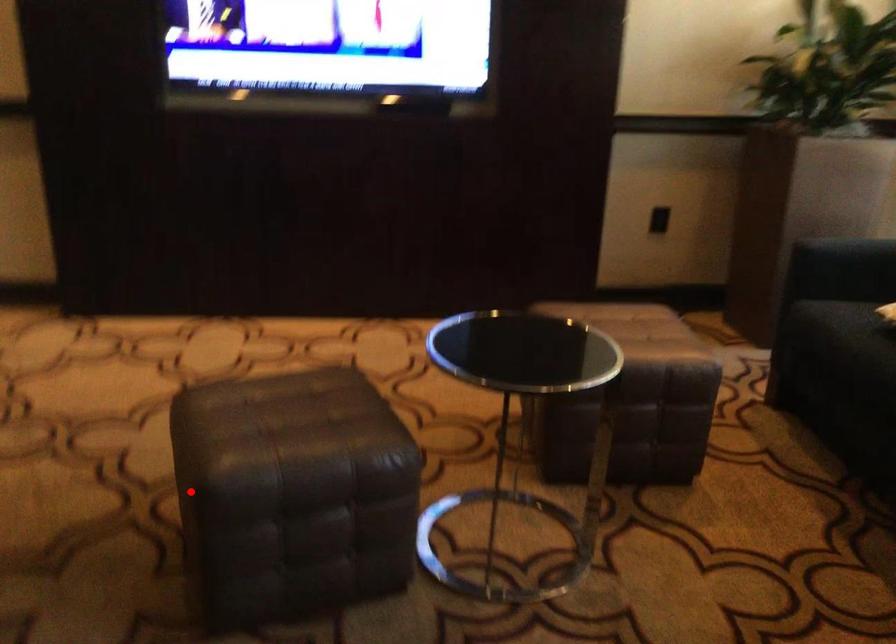
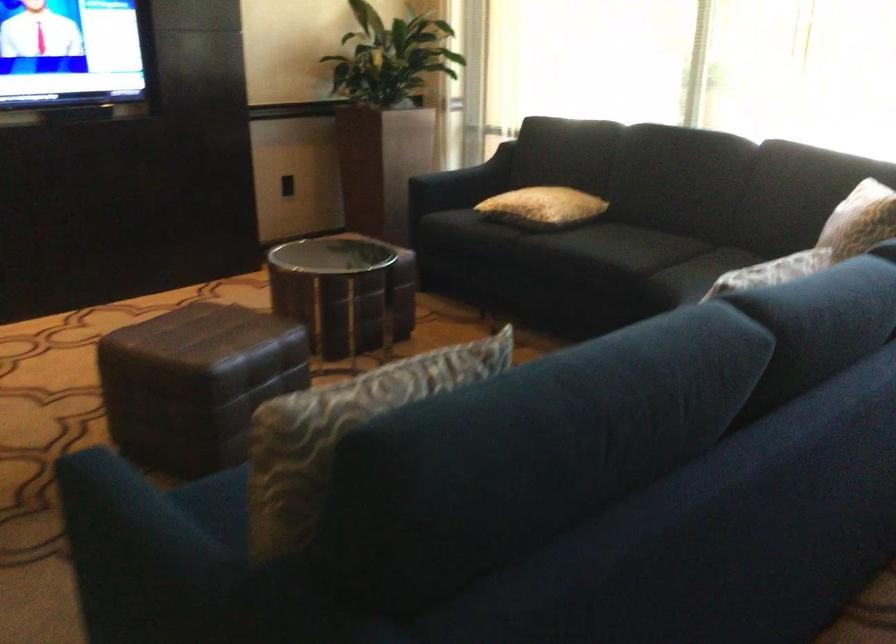
Locate, in the second image, the point that corresponds to the highlighted location in the first image.

(195, 383)